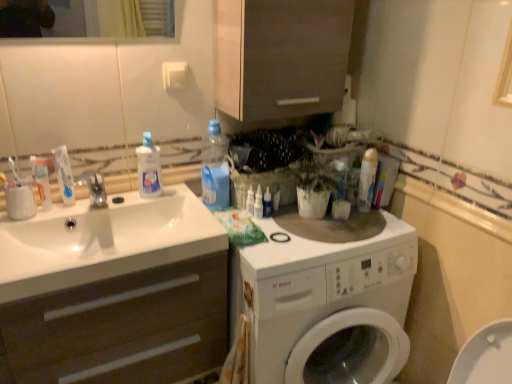
Question: In the image, is white glossy toothpaste at sink, marked as the first toothpaste in a left-to-right arrangement, positioned in front of or behind white matte cabinet at left?

Choices:
 (A) front
 (B) behind

Answer: (B)

Question: From a real-world perspective, is white glossy toothpaste at sink, the 2th toothpaste when ordered from right to left, positioned above or below white matte cabinet at left?

Choices:
 (A) below
 (B) above

Answer: (B)

Question: Which of these objects is positioned farthest from the white glossy bottle at center, which is counted as the second toiletry, starting from the left?

Choices:
 (A) white glossy bottle at center, which ranks as the 3th toiletry in left-to-right order
 (B) matte brown cabinet at upper center
 (C) blue plastic bottle at upper center, positioned as the 3th cleaning product in right-to-left order
 (D) white glossy toothpaste at left, the 1th toothpaste when ordered from right to left
 (E) white matte cabinet at left

Answer: (D)

Question: Which is farther from the transparent plastic bottle at upper left, placed as the fourth cleaning product when sorted from right to left?

Choices:
 (A) white glossy bottle at center, the 1th toiletry in the left-to-right sequence
 (B) white glossy toothpaste at sink, marked as the first toothpaste in a left-to-right arrangement
 (C) white glossy bottle at center, placed as the 2th toiletry when sorted from right to left
 (D) white glossy washing machine at center
 (E) white matte cabinet at left

Answer: (D)